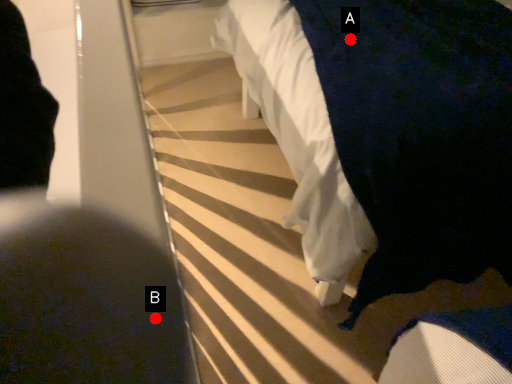
Question: Two points are circled on the image, labeled by A and B beside each circle. Which point is further to the camera?

Choices:
 (A) A is further
 (B) B is further

Answer: (B)